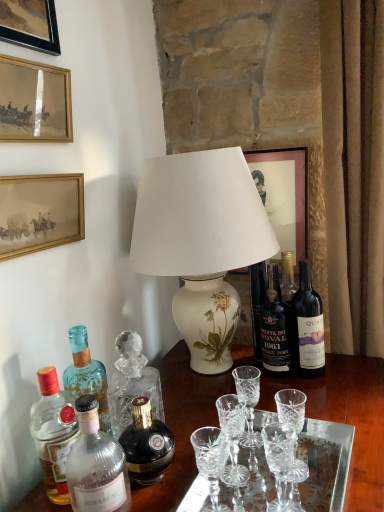
Question: Is dark glass bottle at right, marked as the 5th bottle in a left-to-right arrangement, not inside gold-framed picture at upper left, which is the third picture frame from left to right?

Choices:
 (A) yes
 (B) no

Answer: (A)

Question: From a real-world perspective, does dark glass bottle at right, marked as the 5th bottle in a left-to-right arrangement, sit lower than gold-framed picture at upper left, which appears as the 2th picture frame when viewed from the right?

Choices:
 (A) no
 (B) yes

Answer: (B)

Question: Can you confirm if dark glass bottle at right, acting as the first bottle starting from the right, is taller than gold-framed picture at upper left, which is the third picture frame from left to right?

Choices:
 (A) yes
 (B) no

Answer: (A)

Question: Is gold-framed picture at upper left, which is the third picture frame from left to right, a part of dark glass bottle at right, marked as the 5th bottle in a left-to-right arrangement?

Choices:
 (A) no
 (B) yes

Answer: (A)

Question: Does dark glass bottle at right, acting as the first bottle starting from the right, have a lesser height compared to gold-framed picture at upper left, which appears as the 2th picture frame when viewed from the right?

Choices:
 (A) yes
 (B) no

Answer: (B)

Question: From the image's perspective, is dark glass bottle at right, marked as the 5th bottle in a left-to-right arrangement, over gold-framed picture at upper left, which appears as the 2th picture frame when viewed from the right?

Choices:
 (A) no
 (B) yes

Answer: (A)

Question: Is wooden picture frame at upper left, which is the first picture frame in left-to-right order, shorter than matte white picture frame at upper center, which is the 4th picture frame from left to right?

Choices:
 (A) no
 (B) yes

Answer: (B)

Question: Is matte white picture frame at upper center, which is the 4th picture frame from left to right, located within wooden picture frame at upper left, acting as the fourth picture frame starting from the right?

Choices:
 (A) yes
 (B) no

Answer: (B)

Question: Are wooden picture frame at upper left, acting as the fourth picture frame starting from the right, and matte white picture frame at upper center, which is the 4th picture frame from left to right, making contact?

Choices:
 (A) no
 (B) yes

Answer: (A)

Question: From a real-world perspective, is wooden picture frame at upper left, acting as the fourth picture frame starting from the right, physically below matte white picture frame at upper center, which is the 4th picture frame from left to right?

Choices:
 (A) no
 (B) yes

Answer: (A)

Question: Can you confirm if wooden picture frame at upper left, which is the first picture frame in left-to-right order, is smaller than matte white picture frame at upper center, which is the 4th picture frame from left to right?

Choices:
 (A) yes
 (B) no

Answer: (A)

Question: Is wooden picture frame at upper left, which is the first picture frame in left-to-right order, bigger than matte white picture frame at upper center, which is the 4th picture frame from left to right?

Choices:
 (A) yes
 (B) no

Answer: (B)

Question: Is gold-framed picture at upper left, which is the third picture frame from left to right, turned away from wooden picture frame at upper left, which is the first picture frame in left-to-right order?

Choices:
 (A) no
 (B) yes

Answer: (A)